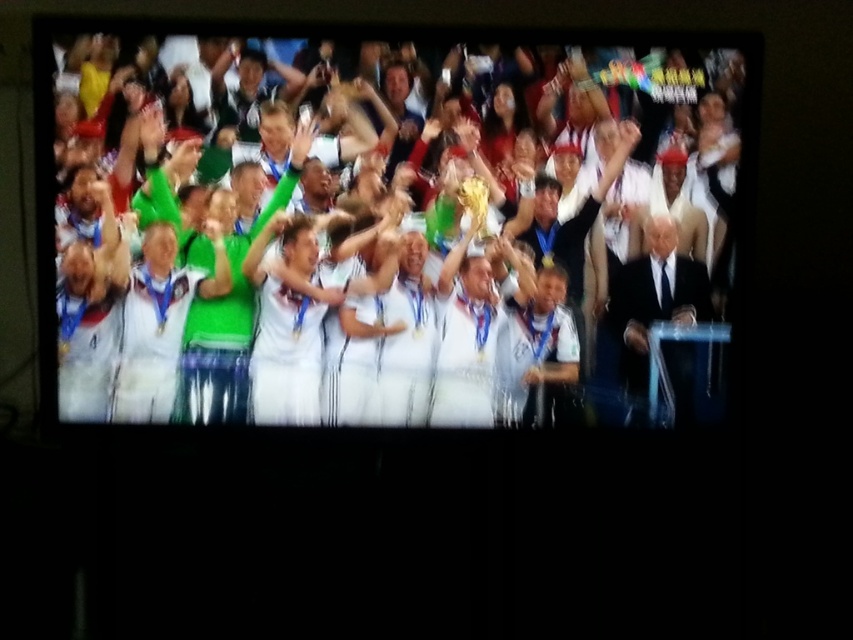
Is the position of white jersey trophy at center more distant than that of gold shiny trophy at center?

No, white jersey trophy at center is closer to the viewer.

Does white jersey trophy at center have a greater height compared to gold shiny trophy at center?

Indeed, white jersey trophy at center has a greater height compared to gold shiny trophy at center.

Who is more distant from viewer, (247, 173) or (479, 209)?

The point (479, 209) is behind.

Locate an element on the screen. The height and width of the screenshot is (640, 853). white jersey trophy at center is located at coordinates (376, 225).

Is black suit at right closer to camera compared to gold shiny trophy at center?

Yes, black suit at right is in front of gold shiny trophy at center.

Which is behind, point (693, 294) or point (479, 216)?

Point (479, 216)

The height and width of the screenshot is (640, 853). What do you see at coordinates (654, 298) in the screenshot?
I see `black suit at right` at bounding box center [654, 298].

What are the coordinates of `black suit at right` in the screenshot? It's located at (654, 298).

Which is in front, point (682, 36) or point (625, 276)?

Point (682, 36)

Between white jersey trophy at center and black suit at right, which one appears on the left side from the viewer's perspective?

Positioned to the left is white jersey trophy at center.

Which is behind, point (685, 280) or point (683, 362)?

Positioned behind is point (683, 362).

You are a GUI agent. You are given a task and a screenshot of the screen. Output one action in this format:
    pyautogui.click(x=<x>, y=<y>)
    Task: Click on the white jersey trophy at center
    Image resolution: width=853 pixels, height=640 pixels.
    Given the screenshot: What is the action you would take?
    pyautogui.click(x=376, y=225)